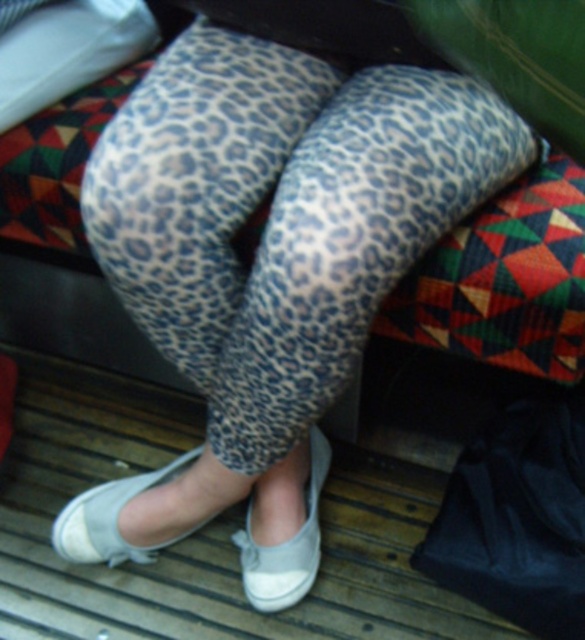
You are a fashion designer observing the image. You need to place a decorative sticker between the gray fabric shoe at lower center and the white fabric sock at lower center. Is there enough space to fit a sticker that is 3 centimeters wide?

The gray fabric shoe at lower center and white fabric sock at lower center are 3.61 centimeters apart. Since the sticker is 3 centimeters wide, there is sufficient space to place it between them.

You are trying to decide which item to take with you for a short walk. You see the white canvas shoe at lower center and the white fabric sock at lower center. Which one is bigger in size?

The white canvas shoe at lower center is larger in size than the white fabric sock at lower center.

In the scene shown: You are a photographer setting up a shot focusing on the gray fabric shoe at lower center. You want to ensure the shoe is in focus while keeping the background slightly blurred. If your camera has a depth of field setting that can blur objects beyond 1.05 meters from the lens, will the background elements like the leopard print leggings be out of focus?

The gray fabric shoe at lower center is 1.02 meters from the camera. Since the depth of field blurs objects beyond 1.05 meters, the leopard print leggings, being closer than 1.05 meters, would remain in focus. Thus, the background elements like the leggings won